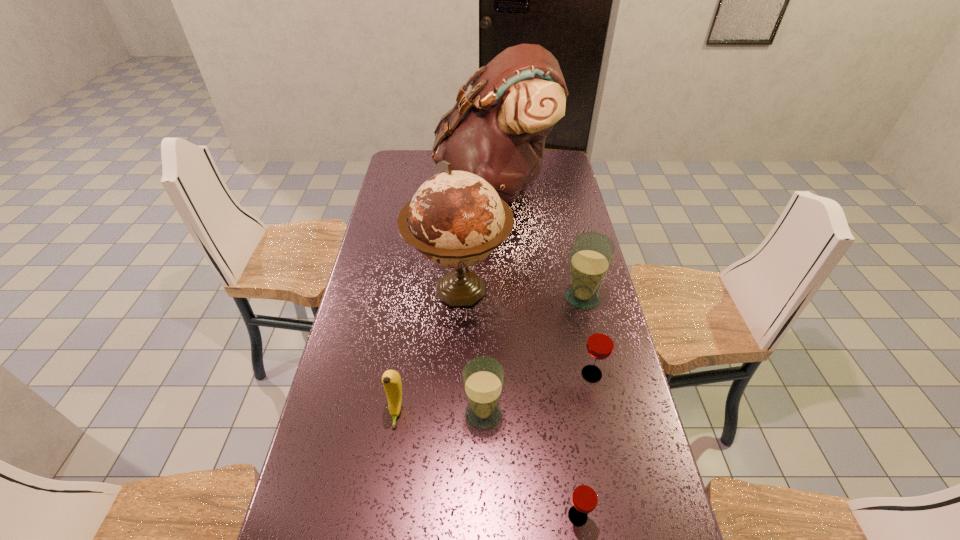
I want to click on vacant space that satisfies the following two spatial constraints: 1. at the front of the farthest object with buckles; 2. on the left side of the third glass from right to left, so click(x=507, y=516).

I want to click on vacant space that satisfies the following two spatial constraints: 1. on the front of the globe showing Asia; 2. on the right side of the nearest object, so click(x=448, y=516).

Identify the location of free space that satisfies the following two spatial constraints: 1. at the front of the farthest object with buckles; 2. on the front side of the nearer blue glass. (503, 413).

Where is `vacant region that satisfies the following two spatial constraints: 1. from the stem of the banana; 2. on the right side of the third farthest glass`? Image resolution: width=960 pixels, height=540 pixels. vacant region that satisfies the following two spatial constraints: 1. from the stem of the banana; 2. on the right side of the third farthest glass is located at coordinates (396, 413).

The image size is (960, 540). I want to click on vacant space that satisfies the following two spatial constraints: 1. from the stem of the nearest object; 2. on the left side of the banana, so click(381, 516).